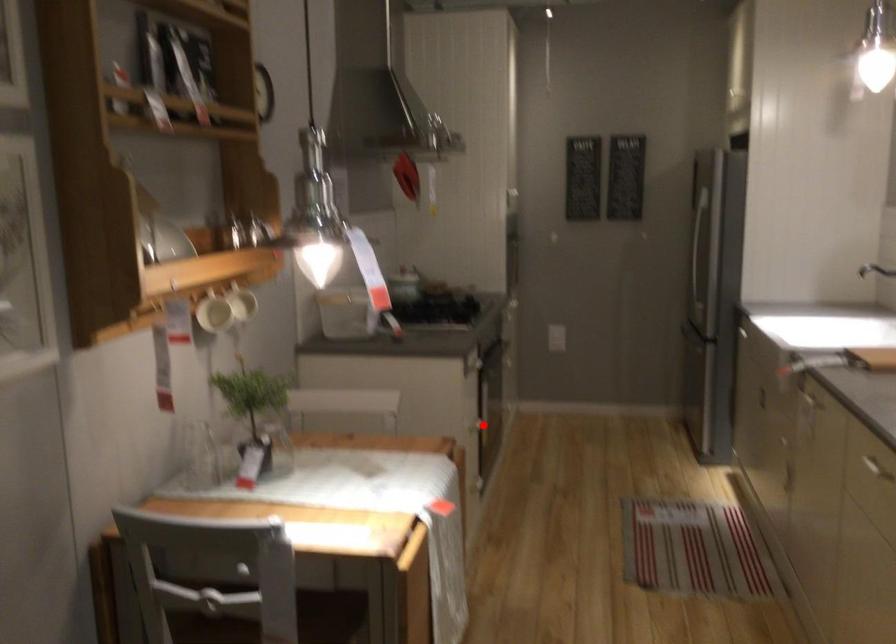
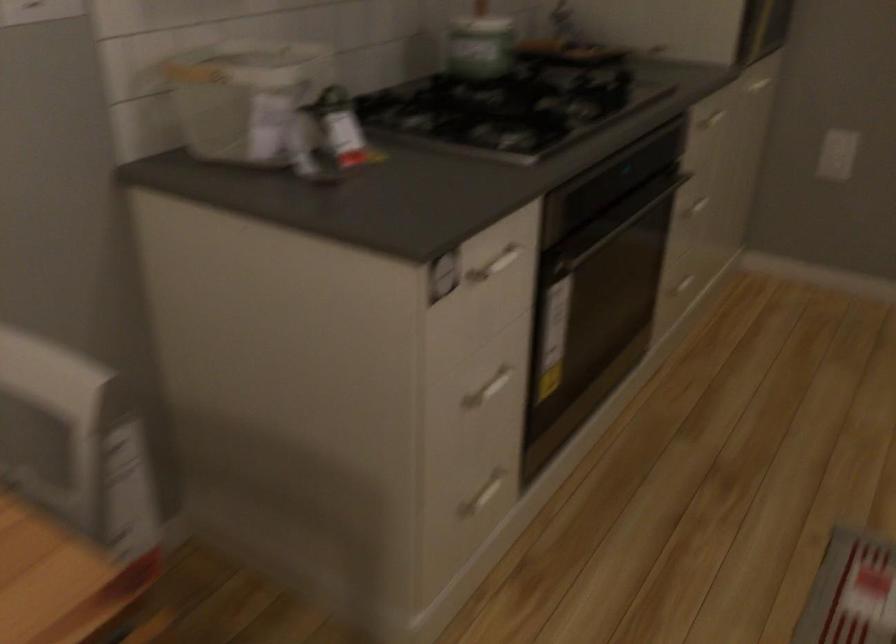
Question: I am providing you with two images of the same scene from different viewpoints. Image1 has a red point marked. In image2, the corresponding 3D location appears at what relative position? Reply with the corresponding letter.

Choices:
 (A) Closer
 (B) Farther

Answer: (A)